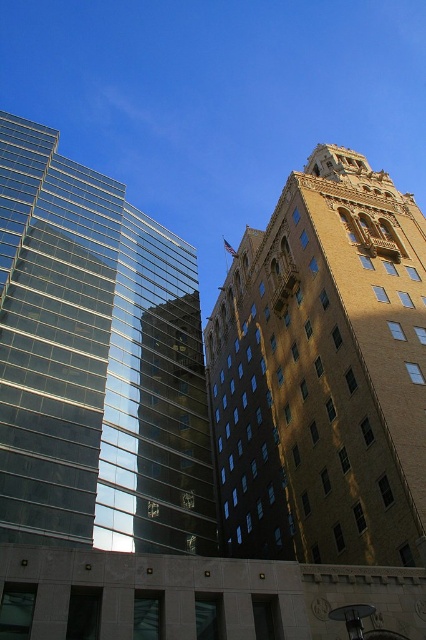
Is golden stone tower at upper right bigger than transparent glass building at left?

Indeed, golden stone tower at upper right has a larger size compared to transparent glass building at left.

This screenshot has width=426, height=640. I want to click on golden stone tower at upper right, so click(324, 372).